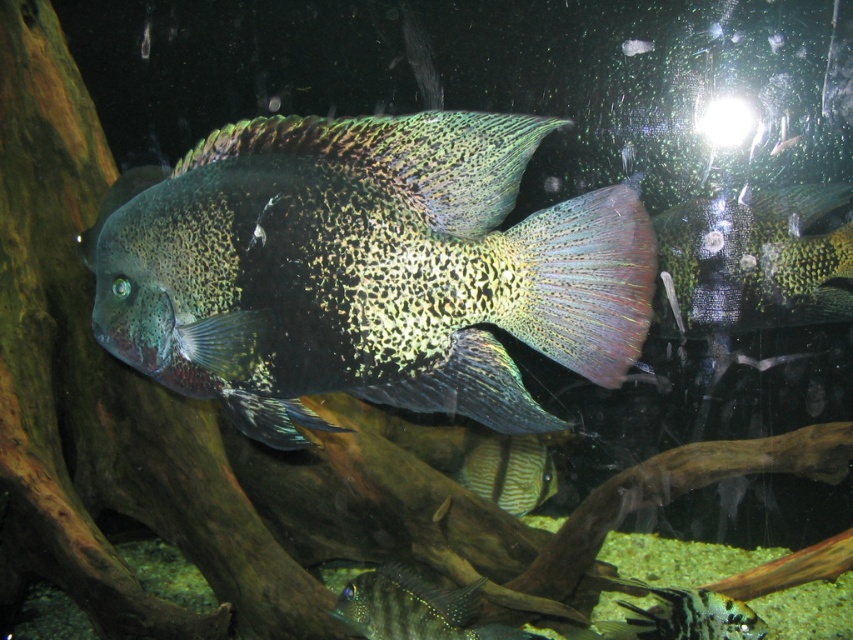
Question: Which point is closer to the camera?

Choices:
 (A) green iridescent fish at right
 (B) shiny iridescent fish at center

Answer: (B)

Question: Which object appears closest to the camera in this image?

Choices:
 (A) striped leather fish at center
 (B) shiny iridescent fish at center
 (C) black and white striped fish at lower right

Answer: (B)

Question: Among these objects, which one is farthest from the camera?

Choices:
 (A) black and white striped fish at lower right
 (B) striped leather fish at center
 (C) shiny iridescent fish at center

Answer: (B)

Question: Is shiny iridescent fish at center to the right of black and white striped fish at lower right from the viewer's perspective?

Choices:
 (A) yes
 (B) no

Answer: (B)

Question: Can you confirm if green iridescent fish at right is bigger than black and white striped fish at lower right?

Choices:
 (A) yes
 (B) no

Answer: (A)

Question: Observing the image, what is the correct spatial positioning of shiny iridescent fish at center in reference to black and white striped fish at lower right?

Choices:
 (A) right
 (B) left

Answer: (B)